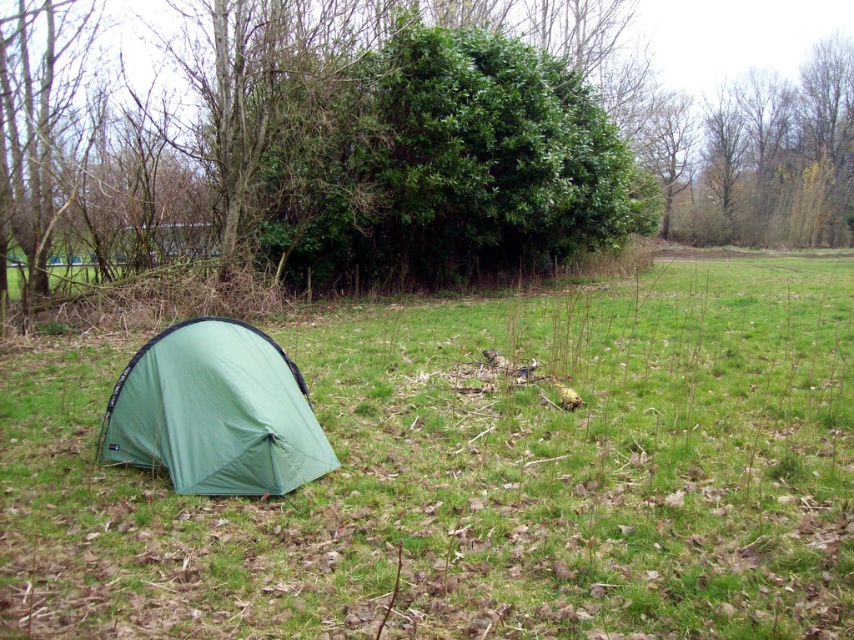
You are setting up a campsite and see the green fabric tent at left and the green nylon tent at lower left. Which tent is positioned higher relative to the other?

The green fabric tent at left is positioned higher than the green nylon tent at lower left.

Based on the photo, you are setting up a campsite and need to decide where to place your gear. The green fabric tent at left and the green leafy bush at center are in your view. Which object is larger in size?

The green leafy bush at center is larger in size compared to the green fabric tent at left.

You are standing at the center of the image and want to move towards the green fabric tent at left. Which direction should you go?

The green fabric tent at left is located at point 0.744 on the x axis and 0.560 on the y axis. Since you are at the center, you should move towards the left and slightly upwards to reach the green fabric tent at left.